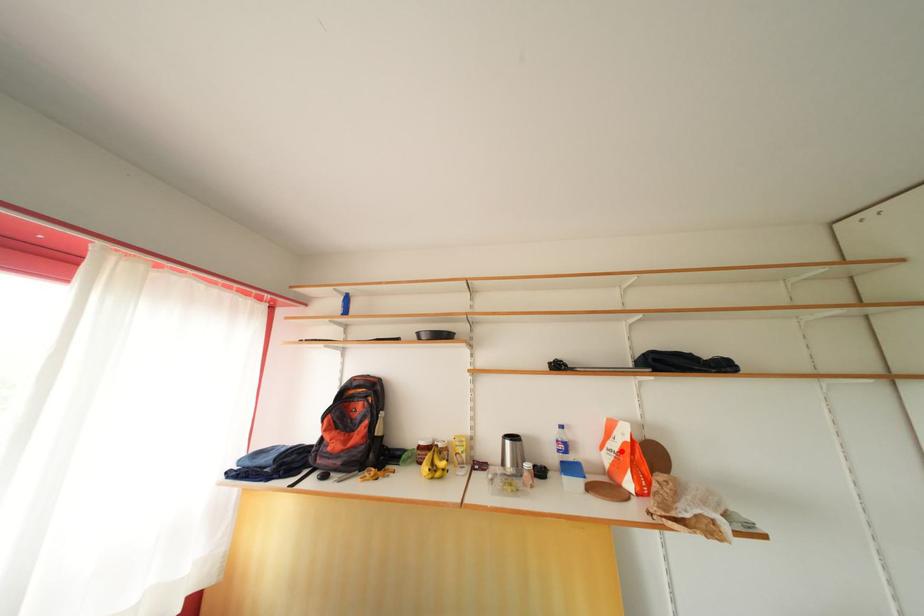
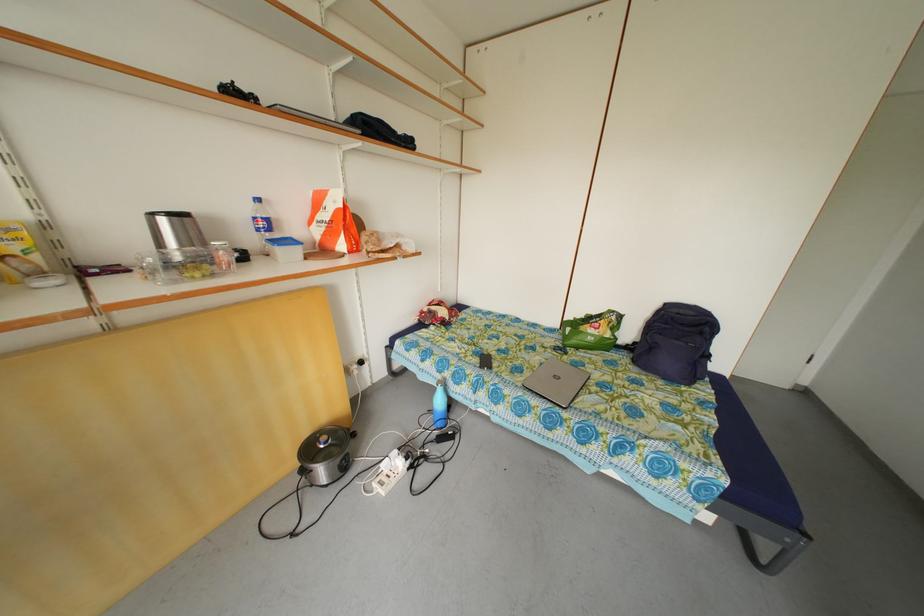
Question: I am providing you with two images of the same scene from different viewpoints. Image1 has a red point marked. In image2, the corresponding 3D location appears at what relative position? Reply with the corresponding letter.

Choices:
 (A) Closer
 (B) Farther

Answer: (A)